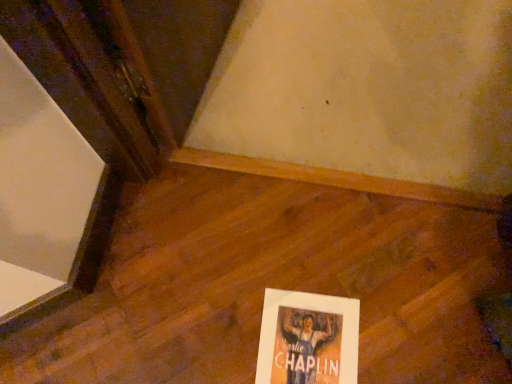
This screenshot has width=512, height=384. What are the coordinates of `vacant region below matte paper poster at lower right (from a real-world perspective)` in the screenshot? It's located at (308, 346).